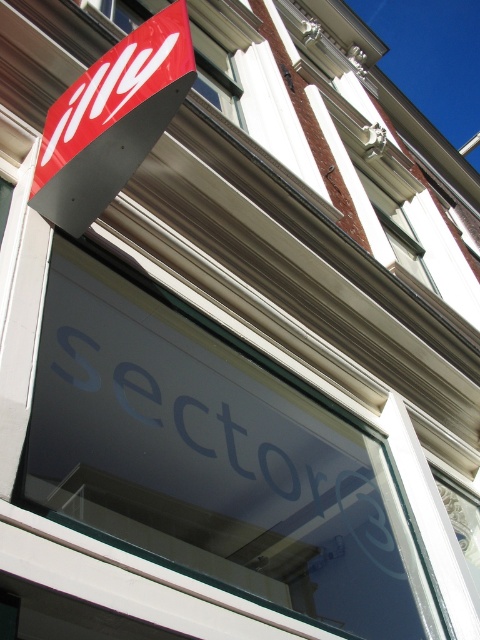
Is matte red sign at upper left positioned behind red matte sign at upper left?

No, it is in front of red matte sign at upper left.

What do you see at coordinates (111, 120) in the screenshot? I see `matte red sign at upper left` at bounding box center [111, 120].

Which is in front, point (188, 81) or point (196, 100)?

Positioned in front is point (188, 81).

This screenshot has width=480, height=640. What are the coordinates of `matte red sign at upper left` in the screenshot? It's located at (111, 120).